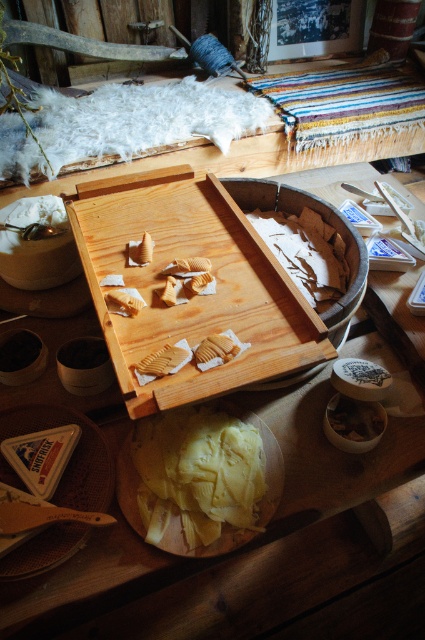
You are a food preparer arranging items on a wooden table. You need to place both the white creamy cheese at lower center and the golden textured cookie at center. According to the scene, where should each item be positioned relative to each other?

The white creamy cheese at lower center should be placed below the golden textured cookie at center as per the spatial arrangement described.

You are a food stylist arranging items on a table. You have a wooden carved piece at center and a golden textured cookie at center. Which item is closer to you when both are placed at the center of the table?

The wooden carved piece at center is closer to you because it is positioned in front of the golden textured cookie at center.

What is located at the point marked by the coordinates [164,358] in the artisanal workspace?

The point marked by the coordinates [164,358] in the artisanal workspace corresponds to a wooden carved piece at center.